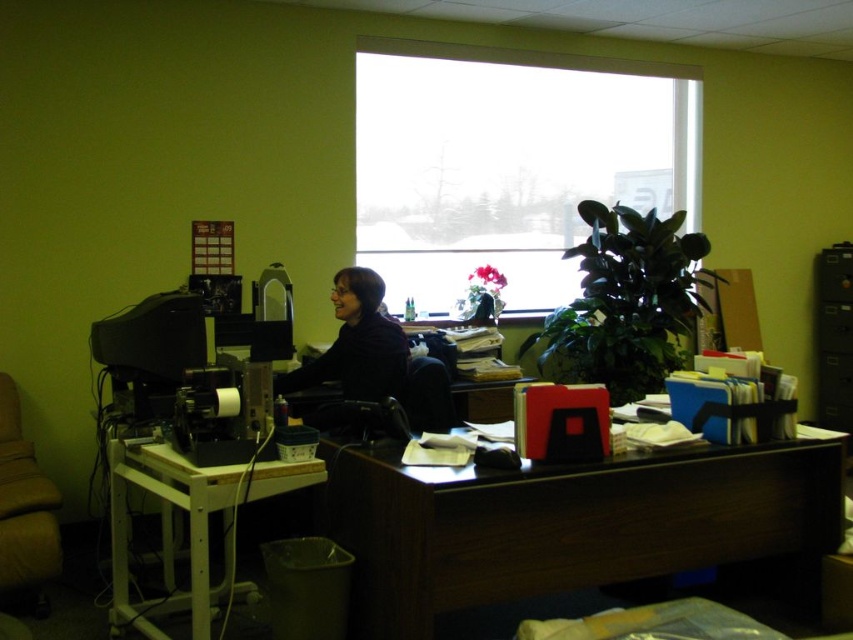
Who is higher up, transparent glass window at upper center or matte black shirt at center?

Positioned higher is transparent glass window at upper center.

From the picture: Is transparent glass window at upper center below matte black shirt at center?

Incorrect, transparent glass window at upper center is not positioned below matte black shirt at center.

This screenshot has height=640, width=853. In order to click on transparent glass window at upper center in this screenshot , I will do click(508, 163).

Who is lower down, matte black shirt at center or brown fabric swivel chair at left?

brown fabric swivel chair at left is below.

Is the position of matte black shirt at center more distant than that of brown fabric swivel chair at left?

That is False.

You are a GUI agent. You are given a task and a screenshot of the screen. Output one action in this format:
    pyautogui.click(x=<x>, y=<y>)
    Task: Click on the matte black shirt at center
    
    Given the screenshot: What is the action you would take?
    pyautogui.click(x=358, y=346)

Image resolution: width=853 pixels, height=640 pixels. Identify the location of matte black shirt at center. (358, 346).

Does transparent glass window at upper center have a smaller size compared to dark wood desk at center?

Incorrect, transparent glass window at upper center is not smaller in size than dark wood desk at center.

Measure the distance between transparent glass window at upper center and camera.

transparent glass window at upper center and camera are 15.17 feet apart from each other.

Find the location of a particular element. The height and width of the screenshot is (640, 853). transparent glass window at upper center is located at coordinates (508, 163).